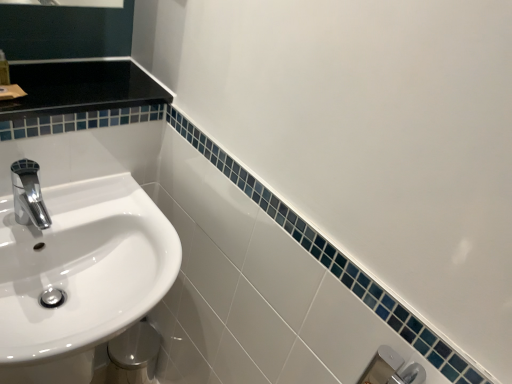
Question: Are white glossy sink at left and chrome/metallic faucet at left far apart?

Choices:
 (A) yes
 (B) no

Answer: (B)

Question: Can you confirm if white glossy sink at left is taller than chrome/metallic faucet at left?

Choices:
 (A) no
 (B) yes

Answer: (B)

Question: Is white glossy sink at left thinner than chrome/metallic faucet at left?

Choices:
 (A) no
 (B) yes

Answer: (A)

Question: Is white glossy sink at left oriented away from chrome/metallic faucet at left?

Choices:
 (A) yes
 (B) no

Answer: (B)

Question: Is white glossy sink at left in contact with chrome/metallic faucet at left?

Choices:
 (A) yes
 (B) no

Answer: (B)

Question: Does white glossy sink at left appear on the right side of chrome/metallic faucet at left?

Choices:
 (A) yes
 (B) no

Answer: (A)

Question: Is the depth of chrome/metallic faucet at left less than that of translucent plastic soap dispenser at upper left?

Choices:
 (A) no
 (B) yes

Answer: (B)

Question: Can you confirm if chrome/metallic faucet at left is positioned to the right of translucent plastic soap dispenser at upper left?

Choices:
 (A) yes
 (B) no

Answer: (A)

Question: From a real-world perspective, is chrome/metallic faucet at left physically above translucent plastic soap dispenser at upper left?

Choices:
 (A) no
 (B) yes

Answer: (A)

Question: Does chrome/metallic faucet at left appear on the left side of translucent plastic soap dispenser at upper left?

Choices:
 (A) no
 (B) yes

Answer: (A)

Question: Does chrome/metallic faucet at left contain translucent plastic soap dispenser at upper left?

Choices:
 (A) yes
 (B) no

Answer: (B)

Question: From a real-world perspective, is chrome/metallic faucet at left beneath translucent plastic soap dispenser at upper left?

Choices:
 (A) no
 (B) yes

Answer: (B)

Question: Does translucent plastic soap dispenser at upper left appear on the left side of white glossy sink at left?

Choices:
 (A) yes
 (B) no

Answer: (A)